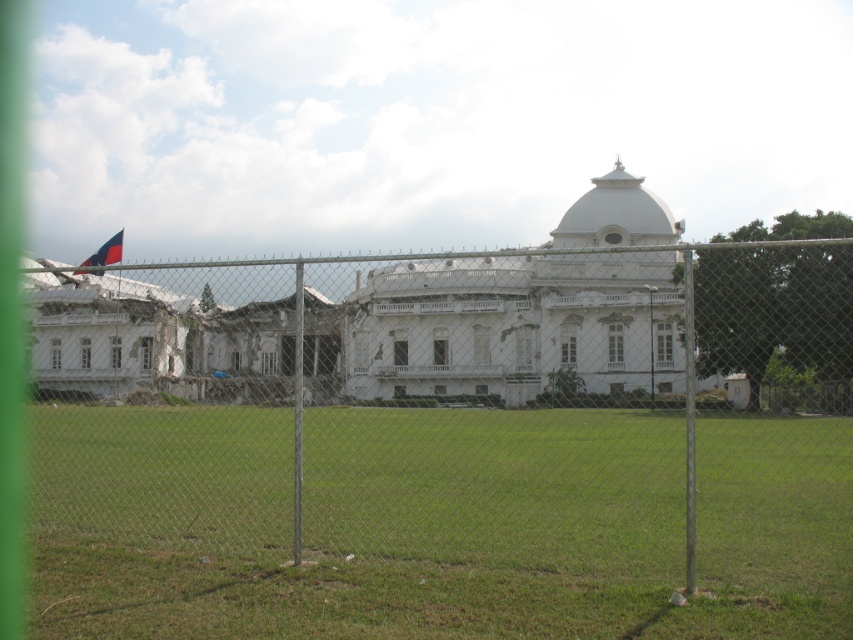
You are standing at the point with coordinates point (456,410). Based on the scene, what object are you currently touching?

The point (456,410) is on metal chain link fence at center, so you are touching the metal chain link fence at center.